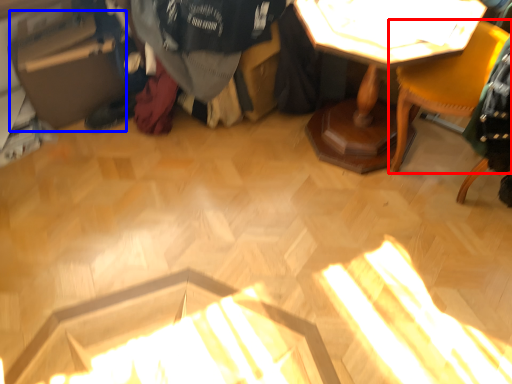
Question: Which object appears farthest to the camera in this image, chair (highlighted by a red box) or cardboard box (highlighted by a blue box)?

Choices:
 (A) chair
 (B) cardboard box

Answer: (B)